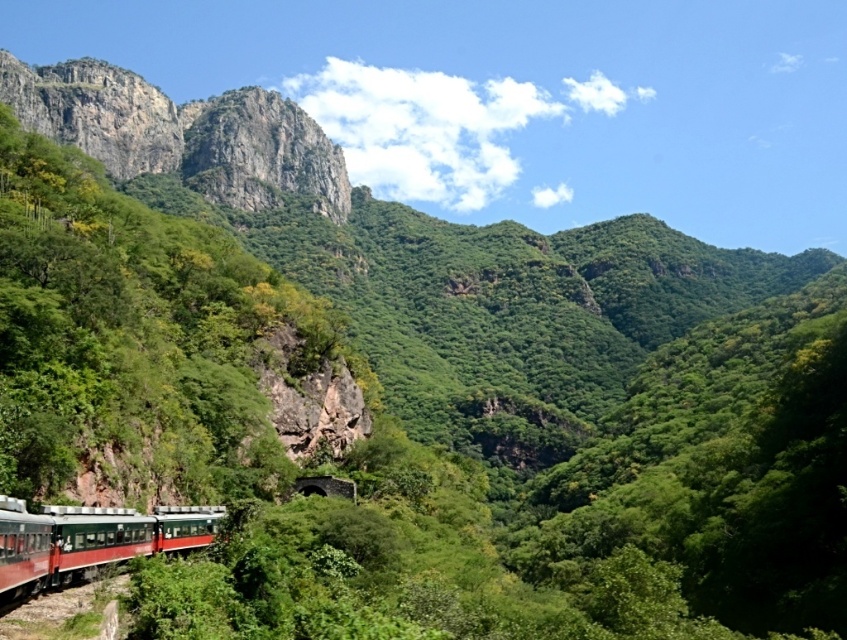
From the picture: You are standing at the point marked as point (181,132) in the valley scene. What geographical feature are you currently standing on?

You are standing on the rugged stone mountain at upper left.

You are standing in the valley and want to take a photo of both the rugged stone mountain at upper left and the metallic green train at lower left. Which object should you adjust your camera focus on first to ensure both are in the frame?

You should focus on the rugged stone mountain at upper left first because it is closer to you than the metallic green train at lower left, so adjusting focus starting from the closer object will help capture both in the frame.